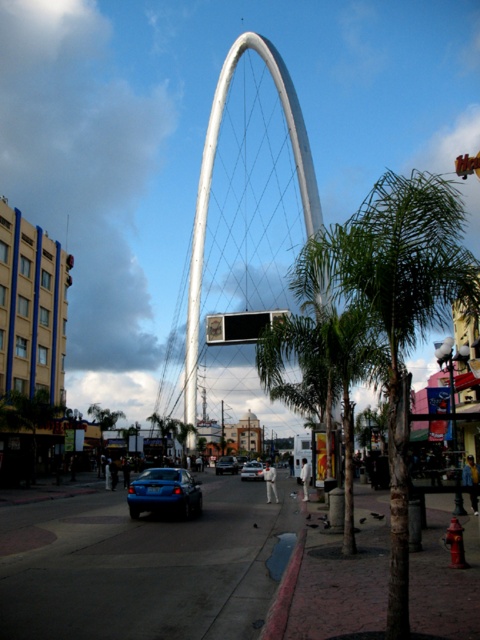
You are standing at the entrance of the commercial area and want to locate the green leafy palm tree at center. According to the coordinates provided, where should you look relative to your position?

The green leafy palm tree at center is located at coordinates point (324,371), which means it is positioned slightly to the right and above your current viewpoint.

You are a pedestrian standing on the sidewalk and want to take a photo of the shiny blue car at center without any obstructions. Is the green leafy palm tree at center blocking your view?

The green leafy palm tree at center is in front of the shiny blue car at center, so it is blocking your view of the car. Move to a different angle to avoid the tree.